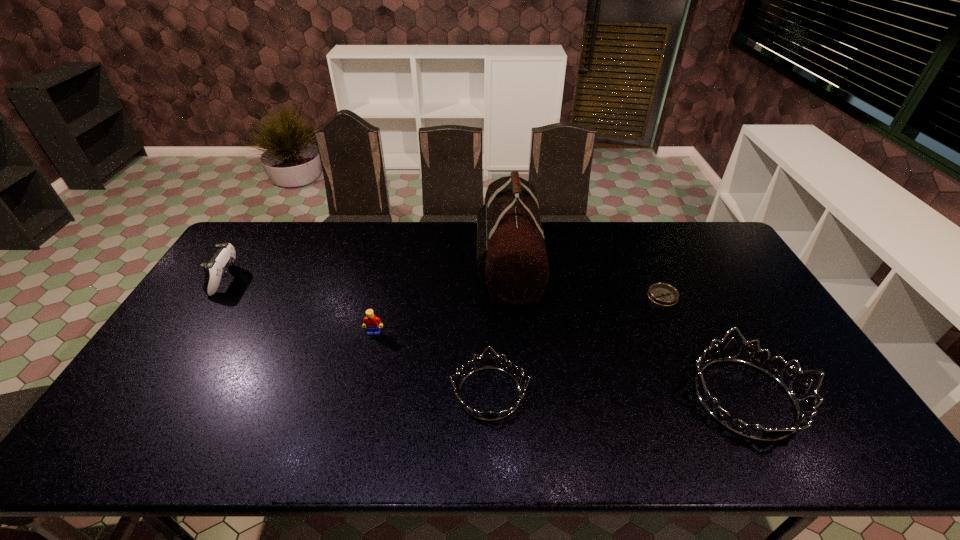
The tiaras are evenly distributed in the image. To maintain this, where would you place another tiara on the left? Please point to a free space. Please provide its 2D coordinates. Your answer should be formatted as a tuple, i.e. [(x, y)], where the tuple contains the x and y coordinates of a point satisfying the conditions above.

[(239, 389)]